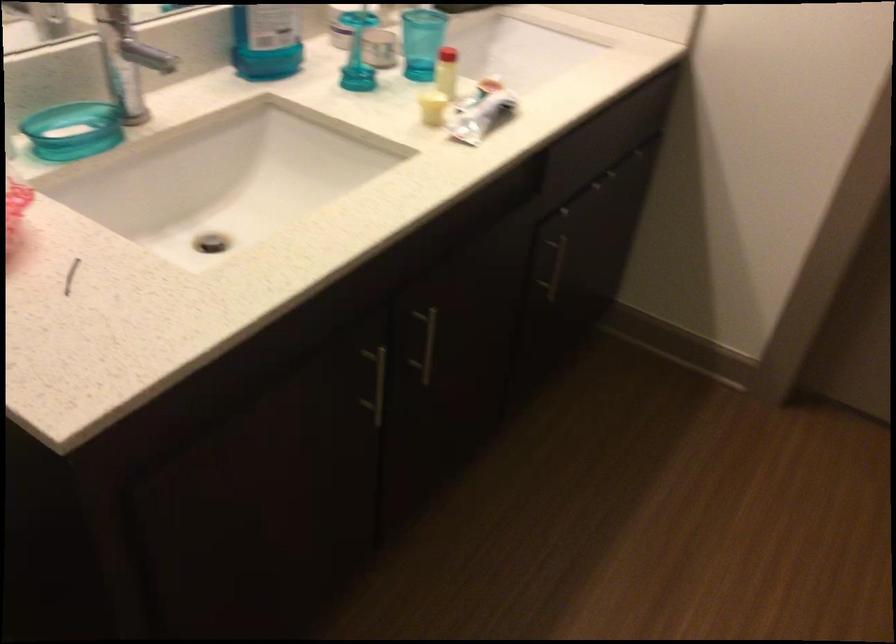
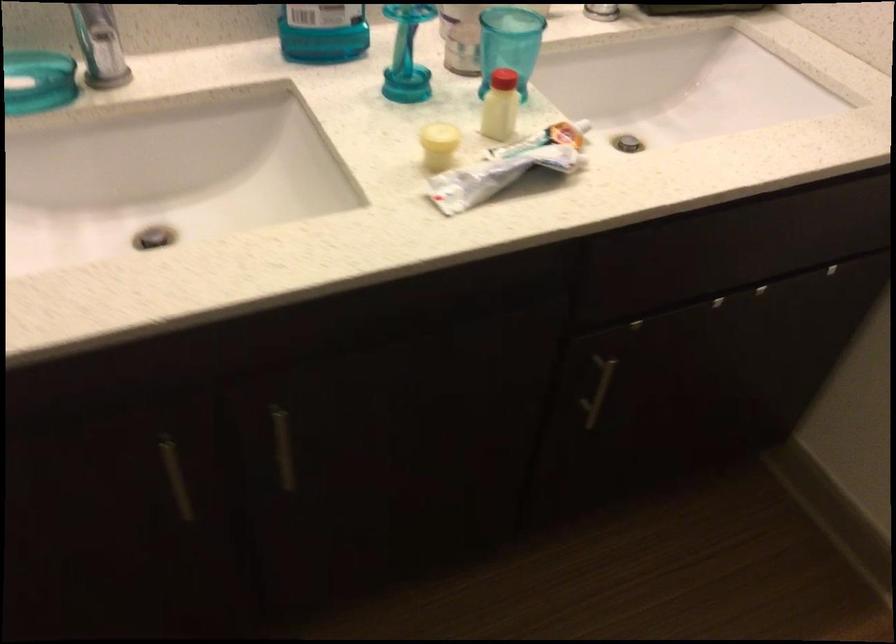
The point at (554,269) is marked in the first image. Where is the corresponding point in the second image?

(598, 391)